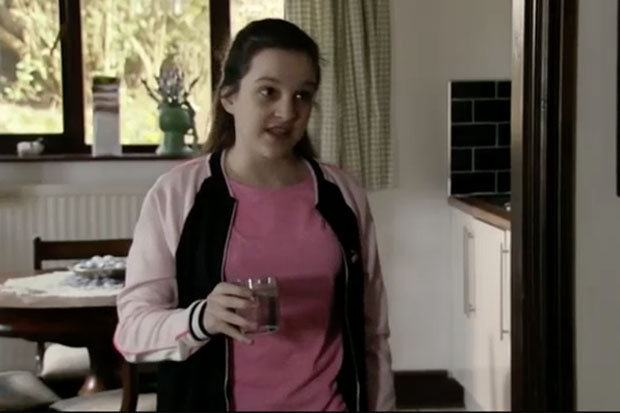
Image resolution: width=620 pixels, height=413 pixels. Find the location of `cabinets`. cabinets is located at coordinates (459, 321), (493, 345).